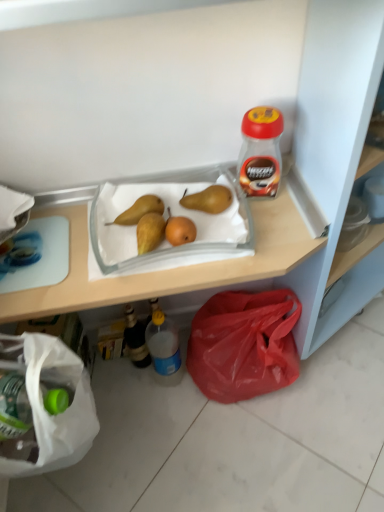
At what (x,y) coordinates should I click in order to perform the action: click on free space in front of brown matte pear at center, arranged as the second pear when viewed from the left. Please return your answer as a coordinate pair (x, y). Looking at the image, I should click on (220, 236).